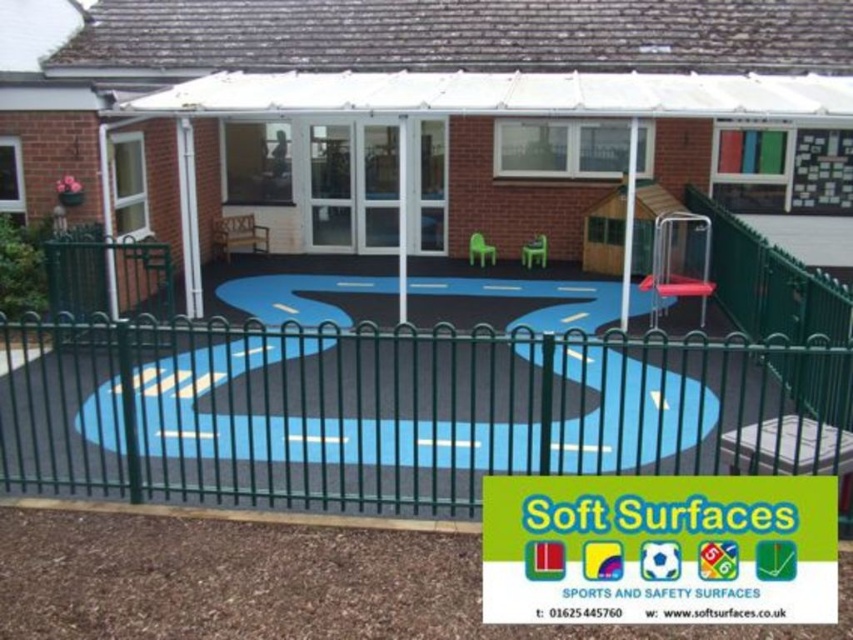
Question: Which point is closer to the camera?

Choices:
 (A) green metal fence at center
 (B) metallic silver swing at center right

Answer: (A)

Question: Which of the following is the farthest from the observer?

Choices:
 (A) green metal fence at center
 (B) metallic silver swing at center right

Answer: (B)

Question: Observing the image, what is the correct spatial positioning of green metal fence at center in reference to metallic silver swing at center right?

Choices:
 (A) left
 (B) right

Answer: (A)

Question: Observing the image, what is the correct spatial positioning of green metal fence at center in reference to metallic silver swing at center right?

Choices:
 (A) above
 (B) below

Answer: (B)

Question: Is green metal fence at center wider than metallic silver swing at center right?

Choices:
 (A) no
 (B) yes

Answer: (B)